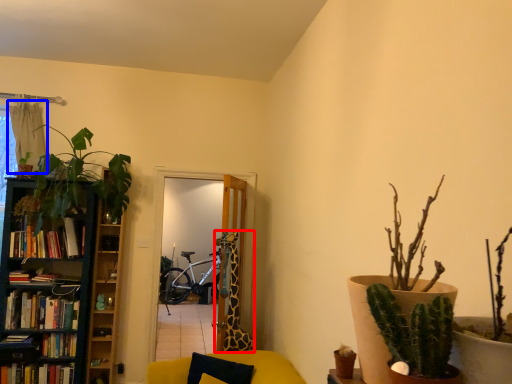
Question: Among these objects, which one is nearest to the camera, giraffe (highlighted by a red box) or curtain (highlighted by a blue box)?

Choices:
 (A) giraffe
 (B) curtain

Answer: (A)